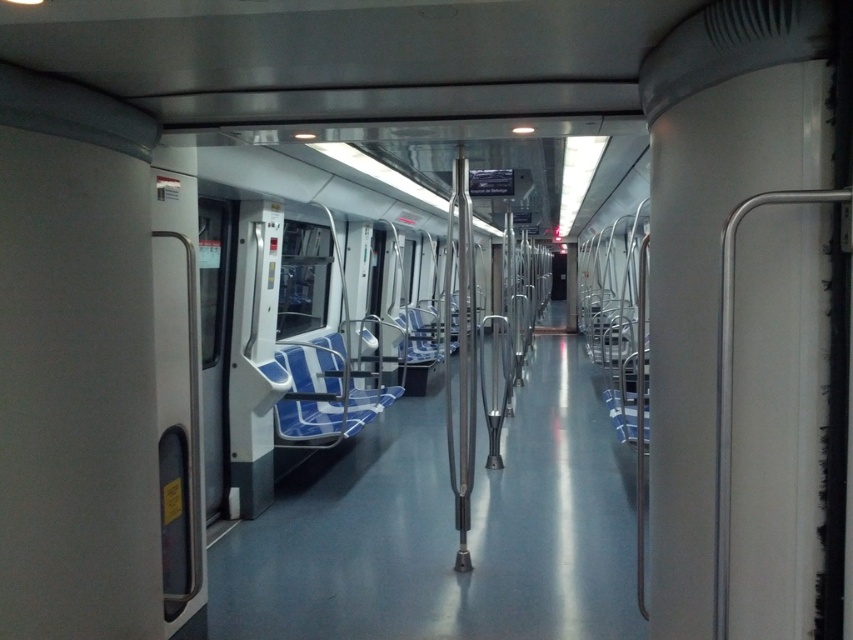
You are a passenger on a train and need to sit down. You see a blue fabric chair at center and a blue fabric seat at center. Which one is on the left side from your perspective?

The blue fabric chair at center is on the left side from your perspective because it is positioned to the left of the blue fabric seat at center.

You are a passenger in the train and want to sit down. You see both the blue fabric chair at center and the blue fabric seat at center. Which one is higher up?

The blue fabric chair at center is located above the blue fabric seat at center, so the blue fabric chair at center is higher up.